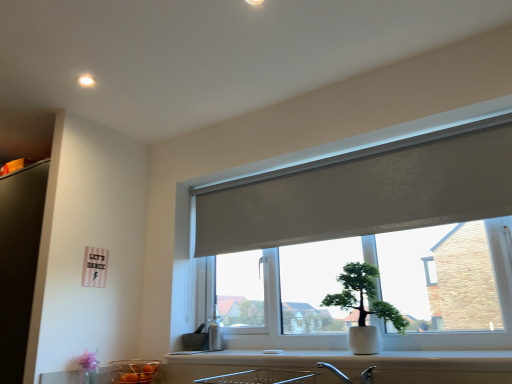
Question: From the image's perspective, is white glossy counter top at lower center above matte gray roller blind at center?

Choices:
 (A) no
 (B) yes

Answer: (A)

Question: Is white glossy counter top at lower center thinner than matte gray roller blind at center?

Choices:
 (A) yes
 (B) no

Answer: (B)

Question: Is white glossy counter top at lower center at the right side of matte gray roller blind at center?

Choices:
 (A) no
 (B) yes

Answer: (A)

Question: Does white glossy counter top at lower center have a larger size compared to matte gray roller blind at center?

Choices:
 (A) no
 (B) yes

Answer: (A)

Question: Is white glossy counter top at lower center shorter than matte gray roller blind at center?

Choices:
 (A) no
 (B) yes

Answer: (B)

Question: From the image's perspective, would you say white glossy counter top at lower center is shown under matte gray roller blind at center?

Choices:
 (A) yes
 (B) no

Answer: (A)

Question: Is translucent glass bowl at lower left turned away from white glossy counter top at lower center?

Choices:
 (A) yes
 (B) no

Answer: (B)

Question: From the image's perspective, is translucent glass bowl at lower left on top of white glossy counter top at lower center?

Choices:
 (A) yes
 (B) no

Answer: (B)

Question: Does translucent glass bowl at lower left appear on the left side of white glossy counter top at lower center?

Choices:
 (A) no
 (B) yes

Answer: (B)

Question: Is translucent glass bowl at lower left not close to white glossy counter top at lower center?

Choices:
 (A) no
 (B) yes

Answer: (A)

Question: Considering the relative sizes of translucent glass bowl at lower left and white glossy counter top at lower center in the image provided, is translucent glass bowl at lower left shorter than white glossy counter top at lower center?

Choices:
 (A) no
 (B) yes

Answer: (A)

Question: Does translucent glass bowl at lower left have a larger size compared to white glossy counter top at lower center?

Choices:
 (A) yes
 (B) no

Answer: (B)

Question: Could white ceramic pot at center be considered to be inside white glossy counter top at lower center?

Choices:
 (A) yes
 (B) no

Answer: (B)